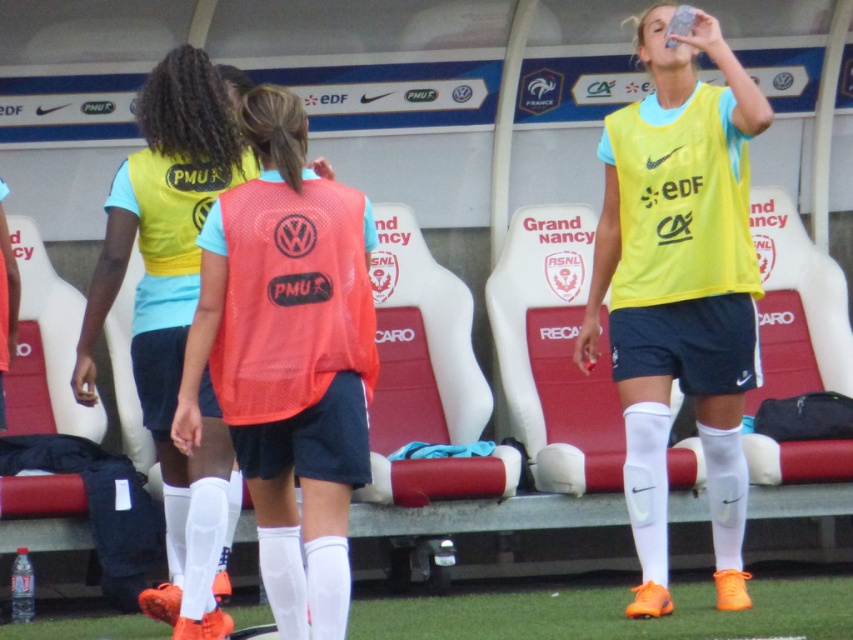
Question: Which point is closer to the camera?

Choices:
 (A) (693, 134)
 (B) (16, 621)
 (C) (160, 413)

Answer: (C)

Question: Does matte yellow vest at center have a larger size compared to clear plastic bottle at lower left?

Choices:
 (A) yes
 (B) no

Answer: (A)

Question: Estimate the real-world distances between objects in this image. Which object is farther from the matte yellow vest at center?

Choices:
 (A) yellow matte jersey at center
 (B) clear plastic bottle at lower left

Answer: (A)

Question: Which object is positioned closest to the clear plastic bottle at lower left?

Choices:
 (A) yellow matte jersey at center
 (B) matte yellow vest at center

Answer: (B)

Question: Is yellow matte jersey at center above matte yellow vest at center?

Choices:
 (A) no
 (B) yes

Answer: (B)

Question: Considering the relative positions of yellow matte jersey at center and matte yellow vest at center in the image provided, where is yellow matte jersey at center located with respect to matte yellow vest at center?

Choices:
 (A) left
 (B) right

Answer: (B)